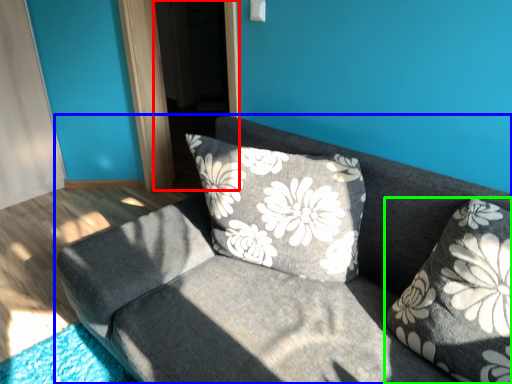
Question: Based on their relative distances, which object is farther from screen door (highlighted by a red box)? Choose from studio couch (highlighted by a blue box) and pillow (highlighted by a green box).

Choices:
 (A) studio couch
 (B) pillow

Answer: (B)